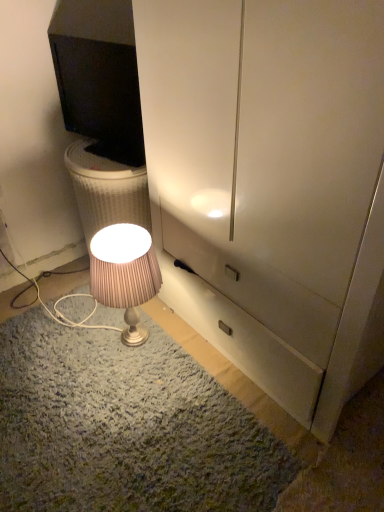
Question: Is point (130, 239) positioned closer to the camera than point (112, 130)?

Choices:
 (A) closer
 (B) farther

Answer: (A)

Question: In terms of height, does matte silver lamp at lower center look taller or shorter compared to black glossy monitor at upper left?

Choices:
 (A) tall
 (B) short

Answer: (A)

Question: From a real-world perspective, relative to black glossy monitor at upper left, is matte silver lamp at lower center vertically above or below?

Choices:
 (A) above
 (B) below

Answer: (B)

Question: From their relative heights in the image, would you say black glossy monitor at upper left is taller or shorter than matte silver lamp at lower center?

Choices:
 (A) tall
 (B) short

Answer: (B)

Question: From the image's perspective, is black glossy monitor at upper left above or below matte silver lamp at lower center?

Choices:
 (A) below
 (B) above

Answer: (B)

Question: In terms of width, does black glossy monitor at upper left look wider or thinner when compared to matte silver lamp at lower center?

Choices:
 (A) wide
 (B) thin

Answer: (B)

Question: Does point click(114, 70) appear closer or farther from the camera than point click(102, 269)?

Choices:
 (A) closer
 (B) farther

Answer: (B)